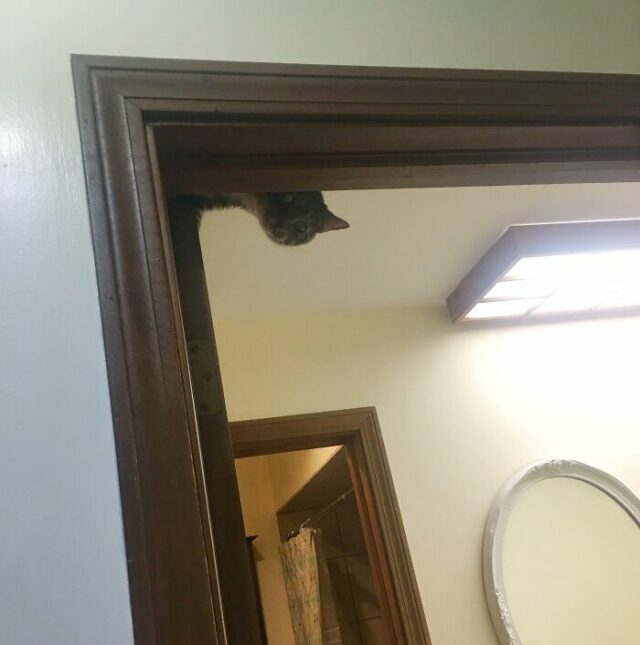
Identify the location of the left door frame. The width and height of the screenshot is (640, 645). (150, 422).